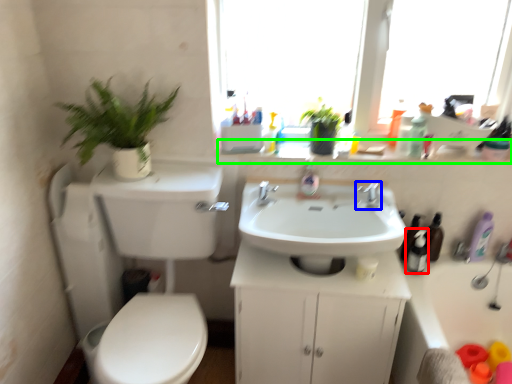
Question: Which is farther away from toiletry (highlighted by a red box)? tap (highlighted by a blue box) or window sill (highlighted by a green box)?

Choices:
 (A) tap
 (B) window sill

Answer: (B)